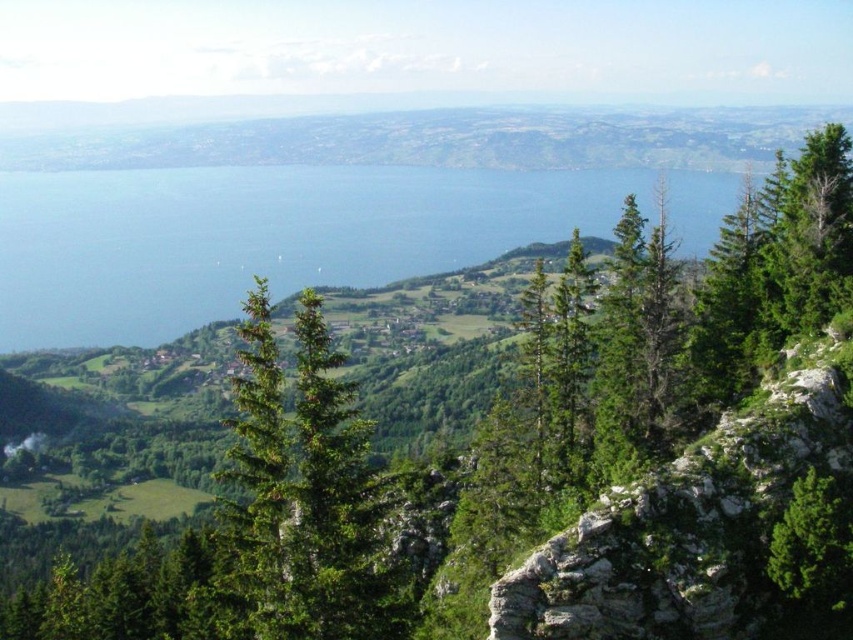
Who is lower down, blue water at center or green textured tree at right?

green textured tree at right

Is point (30, 188) positioned in front of point (792, 600)?

No, (30, 188) is further to viewer.

Find the location of a particular element. blue water at center is located at coordinates (260, 237).